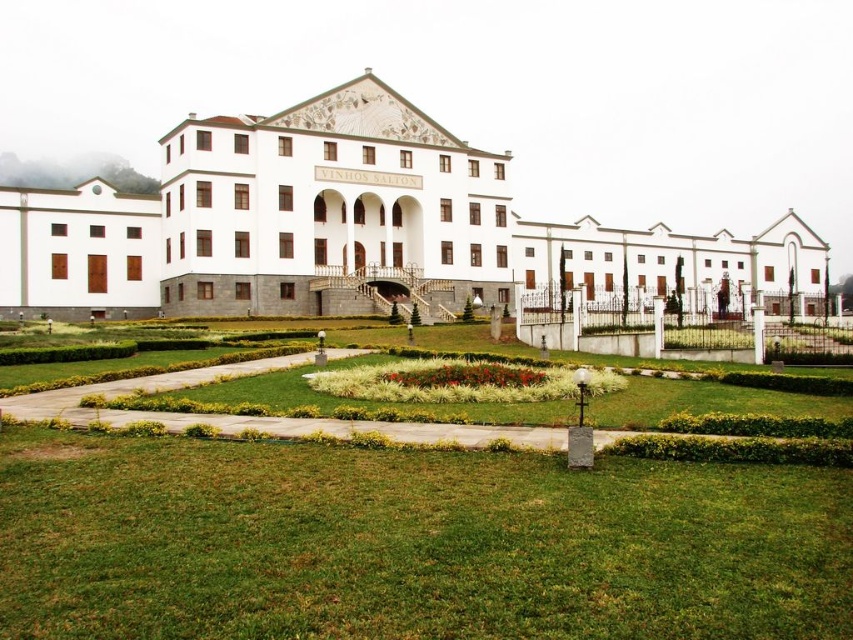
Who is shorter, green grass at center or white stone building at center?

green grass at center is shorter.

You are a GUI agent. You are given a task and a screenshot of the screen. Output one action in this format:
    pyautogui.click(x=<x>, y=<y>)
    Task: Click on the green grass at center
    This screenshot has height=640, width=853.
    Given the screenshot: What is the action you would take?
    pyautogui.click(x=409, y=544)